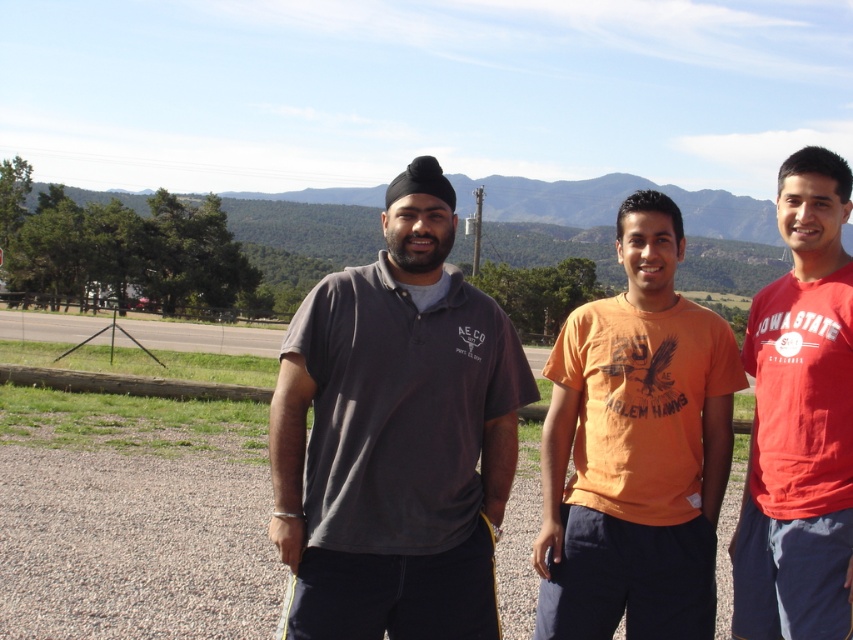
From the picture: You are standing at the point with coordinates (x=635, y=449). Which object are you standing on?

The point with coordinates (x=635, y=449) is on the orange cotton t shirt at center.